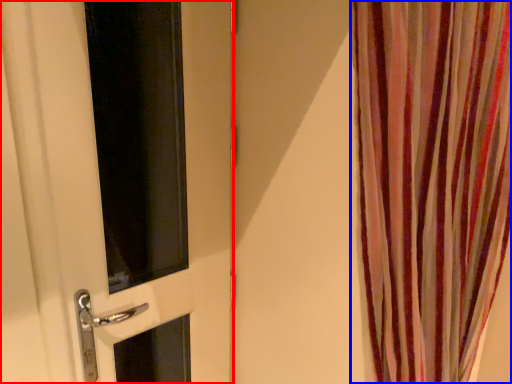
Question: Which object appears closest to the camera in this image, door (highlighted by a red box) or curtain (highlighted by a blue box)?

Choices:
 (A) door
 (B) curtain

Answer: (B)